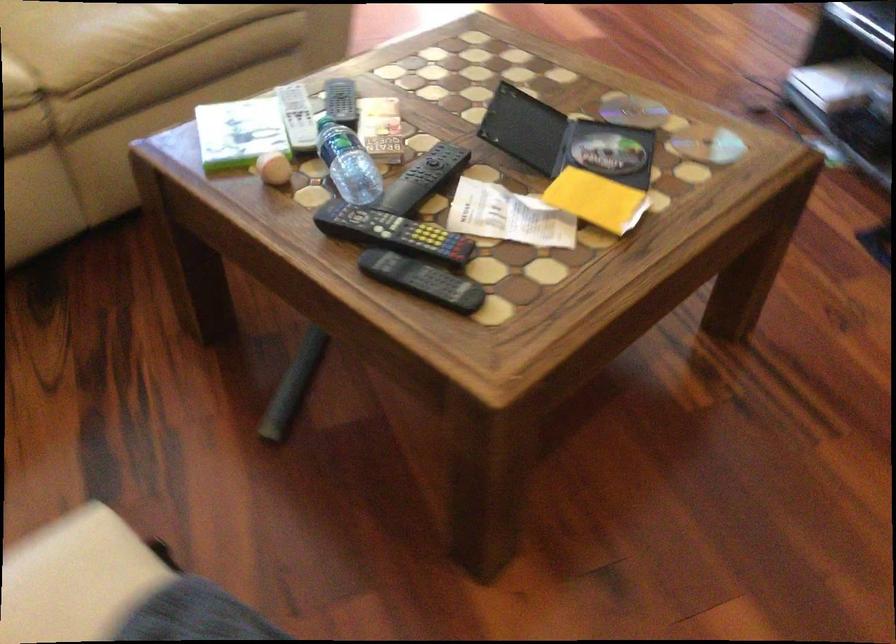
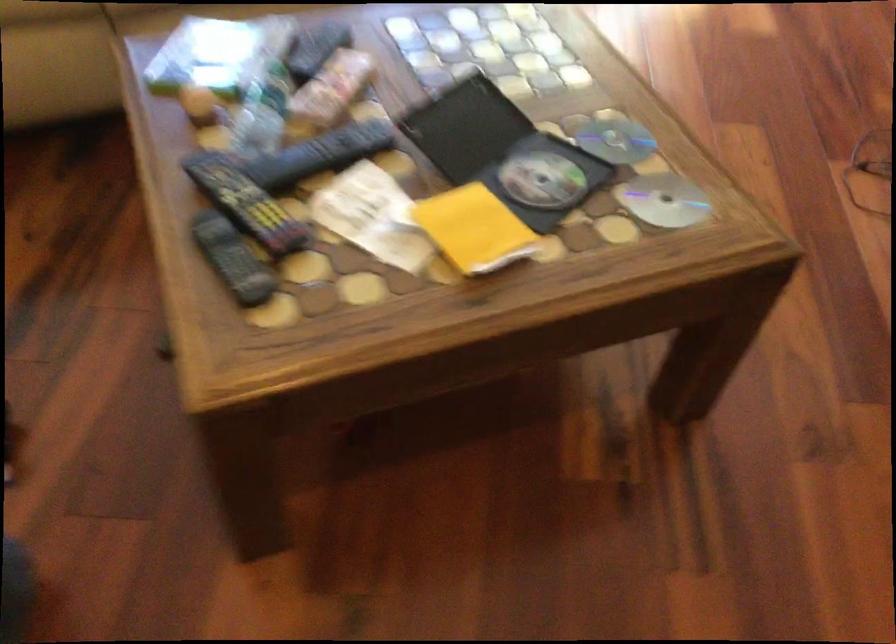
Find the pixel in the second image that matches point 597,198 in the first image.

(474, 229)